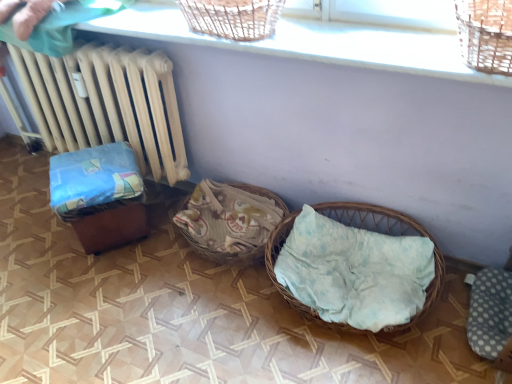
Find the location of a particular element. woven fabric basket at center is located at coordinates (229, 221).

The image size is (512, 384). Describe the element at coordinates (229, 221) in the screenshot. I see `woven fabric basket at center` at that location.

What do you see at coordinates (371, 217) in the screenshot? The height and width of the screenshot is (384, 512). I see `woven wicker basket at lower right` at bounding box center [371, 217].

The width and height of the screenshot is (512, 384). I want to click on wooden brown baby carriage at left, so click(99, 195).

Measure the distance between gray dotted fabric at lower right and camera.

gray dotted fabric at lower right is 4.43 feet from camera.

The width and height of the screenshot is (512, 384). Find the location of `woven wood basket at upper center`. woven wood basket at upper center is located at coordinates (314, 41).

Locate an element on the screen. This screenshot has height=384, width=512. swivel chair below the wooden brown baby carriage at left (from a real-world perspective) is located at coordinates (492, 315).

From the image's perspective, is wooden brown baby carriage at left below gray dotted fabric at lower right?

Actually, wooden brown baby carriage at left appears above gray dotted fabric at lower right in the image.

Is wooden brown baby carriage at left aimed at gray dotted fabric at lower right?

No, wooden brown baby carriage at left is not aimed at gray dotted fabric at lower right.

Which of these two, wooden brown baby carriage at left or gray dotted fabric at lower right, is wider?

Wider between the two is gray dotted fabric at lower right.

Is beige wood radiator at left in contact with woven wood basket at upper center?

No, beige wood radiator at left is not making contact with woven wood basket at upper center.

Is beige wood radiator at left behind woven wood basket at upper center?

Yes, it is behind woven wood basket at upper center.

Is beige wood radiator at left bigger than woven wood basket at upper center?

Indeed, beige wood radiator at left has a larger size compared to woven wood basket at upper center.

Who is bigger, woven wicker basket at lower right or woven fabric basket at center?

woven wicker basket at lower right is bigger.

Consider the image. From the image's perspective, which is below, woven wicker basket at lower right or woven fabric basket at center?

woven wicker basket at lower right appears lower in the image.

From a real-world perspective, is woven wicker basket at lower right above or below woven fabric basket at center?

woven wicker basket at lower right is situated higher than woven fabric basket at center in the real world.

Is woven wicker basket at lower right outside of woven fabric basket at center?

Yes, woven wicker basket at lower right is not within woven fabric basket at center.

Does gray dotted fabric at lower right contain beige wood radiator at left?

No, gray dotted fabric at lower right does not contain beige wood radiator at left.

Can you confirm if gray dotted fabric at lower right is shorter than beige wood radiator at left?

Yes, gray dotted fabric at lower right is shorter than beige wood radiator at left.

Consider the image. Considering the positions of objects gray dotted fabric at lower right and beige wood radiator at left in the image provided, who is more to the left, gray dotted fabric at lower right or beige wood radiator at left?

beige wood radiator at left.

Is point (109, 168) farther from viewer compared to point (404, 226)?

Yes, it is behind point (404, 226).

From the image's perspective, which object appears higher, wooden brown baby carriage at left or woven wicker basket at lower right?

wooden brown baby carriage at left.

From a real-world perspective, is wooden brown baby carriage at left above or below woven wicker basket at lower right?

From a real-world perspective, wooden brown baby carriage at left is physically above woven wicker basket at lower right.

Based on the photo, does woven wicker basket at lower right turn towards woven wood basket at upper center?

No, woven wicker basket at lower right is not turned towards woven wood basket at upper center.

From a real-world perspective, is woven wicker basket at lower right above or below woven wood basket at upper center?

From a real-world perspective, woven wicker basket at lower right is physically below woven wood basket at upper center.

In terms of size, does woven wicker basket at lower right appear bigger or smaller than woven wood basket at upper center?

Clearly, woven wicker basket at lower right is larger in size than woven wood basket at upper center.

Is gray dotted fabric at lower right at the left side of woven fabric basket at center?

Incorrect, gray dotted fabric at lower right is not on the left side of woven fabric basket at center.

From a real-world perspective, is gray dotted fabric at lower right physically located above or below woven fabric basket at center?

In terms of real-world spatial position, gray dotted fabric at lower right is below woven fabric basket at center.

Is gray dotted fabric at lower right next to woven fabric basket at center and touching it?

No, gray dotted fabric at lower right is not next to woven fabric basket at center.

Between gray dotted fabric at lower right and woven fabric basket at center, which one has smaller size?

With smaller size is gray dotted fabric at lower right.

Where is `baby carriage lying behind the gray dotted fabric at lower right`? This screenshot has width=512, height=384. baby carriage lying behind the gray dotted fabric at lower right is located at coordinates (99, 195).

Where is `radiator on the left of woven wood basket at upper center`? radiator on the left of woven wood basket at upper center is located at coordinates (106, 104).

When comparing their distances from gray dotted fabric at lower right, does wooden brown baby carriage at left or woven wood basket at upper center seem further?

Based on the image, wooden brown baby carriage at left appears to be further to gray dotted fabric at lower right.

Considering their positions, is gray dotted fabric at lower right positioned closer to beige wood radiator at left than wooden brown baby carriage at left?

The object closer to beige wood radiator at left is wooden brown baby carriage at left.

Looking at the image, which one is located further to woven wicker basket at lower right, wooden brown baby carriage at left or beige wood radiator at left?

beige wood radiator at left.

Estimate the real-world distances between objects in this image. Which object is closer to woven wood basket at upper center, wooden brown baby carriage at left or woven wicker basket at lower right?

wooden brown baby carriage at left lies closer to woven wood basket at upper center than the other object.

When comparing their distances from beige wood radiator at left, does woven wood basket at upper center or wooden brown baby carriage at left seem closer?

Based on the image, wooden brown baby carriage at left appears to be nearer to beige wood radiator at left.

From the image, which object appears to be farther from wooden brown baby carriage at left, woven fabric basket at center or woven wicker basket at lower right?

woven wicker basket at lower right lies further to wooden brown baby carriage at left than the other object.

From the image, which object appears to be nearer to woven fabric basket at center, woven wood basket at upper center or gray dotted fabric at lower right?

woven wood basket at upper center.

From the picture: When comparing their distances from gray dotted fabric at lower right, does woven fabric basket at center or wooden brown baby carriage at left seem closer?

woven fabric basket at center.

The image size is (512, 384). What are the coordinates of `basket located between beige wood radiator at left and woven wicker basket at lower right in the left-right direction` in the screenshot? It's located at (229, 221).

The width and height of the screenshot is (512, 384). Identify the location of baby carriage situated between beige wood radiator at left and gray dotted fabric at lower right from left to right. (99, 195).

Where is `baby carriage located between beige wood radiator at left and woven wicker basket at lower right in the left-right direction`? The height and width of the screenshot is (384, 512). baby carriage located between beige wood radiator at left and woven wicker basket at lower right in the left-right direction is located at coordinates point(99,195).

The height and width of the screenshot is (384, 512). I want to click on window sill between beige wood radiator at left and gray dotted fabric at lower right from left to right, so click(314, 41).